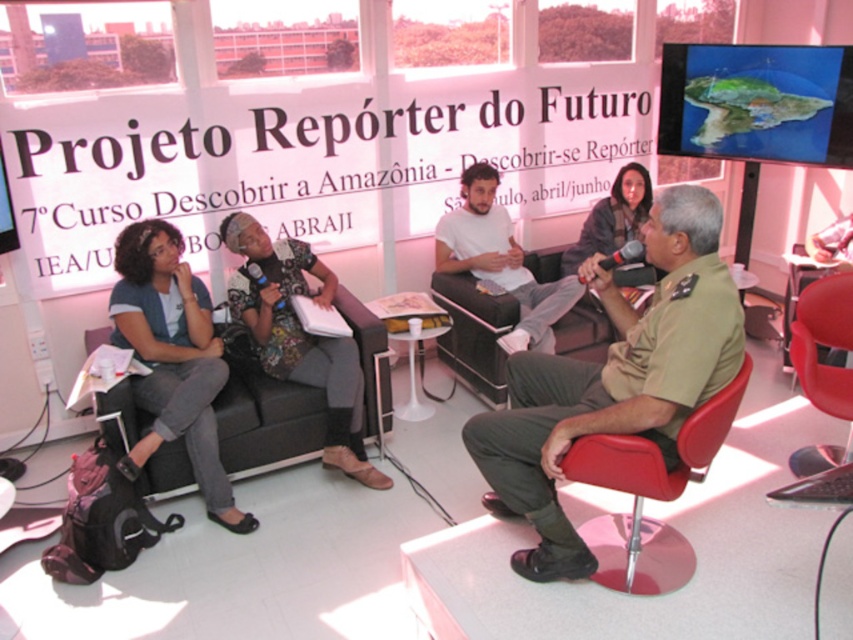
Can you confirm if khaki uniform at center is shorter than matte white shirt at center?

No, khaki uniform at center is not shorter than matte white shirt at center.

Is khaki uniform at center above matte white shirt at center?

No, khaki uniform at center is not above matte white shirt at center.

The width and height of the screenshot is (853, 640). I want to click on khaki uniform at center, so click(x=614, y=380).

Which is in front, point (529, 522) or point (660, 532)?

Positioned in front is point (529, 522).

This screenshot has height=640, width=853. Identify the location of khaki uniform at center. (614, 380).

Describe the element at coordinates (614, 380) in the screenshot. The image size is (853, 640). I see `khaki uniform at center` at that location.

Locate an element on the screen. This screenshot has height=640, width=853. khaki uniform at center is located at coordinates (614, 380).

Which is below, red leather chair at lower right or matte white shirt at center?

red leather chair at lower right is below.

Who is higher up, red leather chair at lower right or matte white shirt at center?

matte white shirt at center

Is point (735, 381) farther from camera compared to point (436, 257)?

That is False.

The width and height of the screenshot is (853, 640). What are the coordinates of `red leather chair at lower right` in the screenshot? It's located at (648, 493).